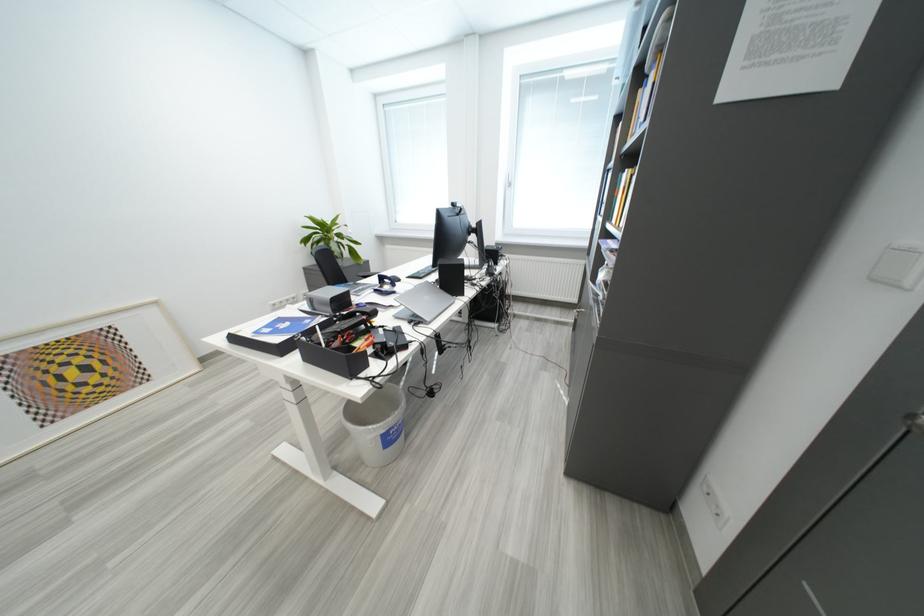
What are the coordinates of `white trash can` in the screenshot? It's located at (377, 424).